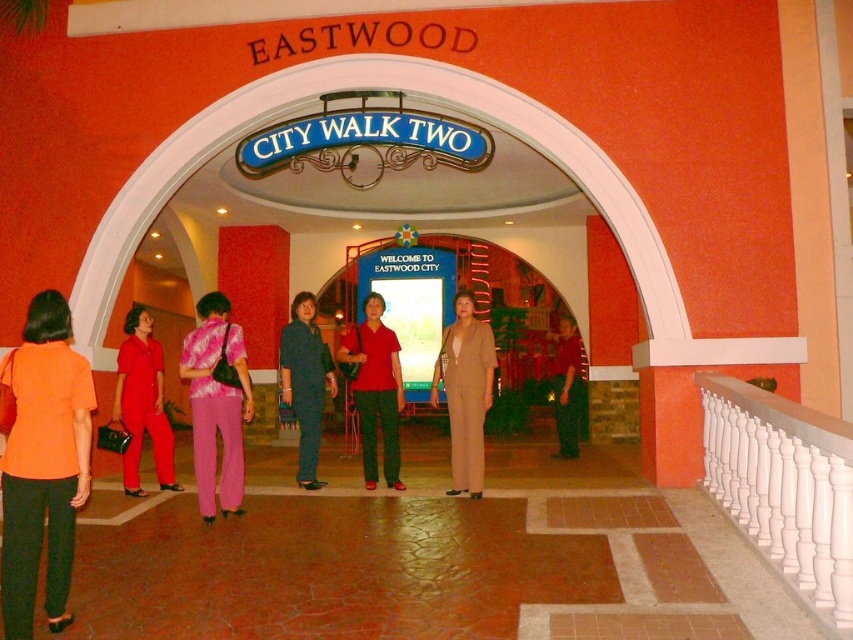
Question: Is dark blue shirt at center wider than matte red pants at center?

Choices:
 (A) no
 (B) yes

Answer: (B)

Question: Which object appears farthest from the camera in this image?

Choices:
 (A) white glossy balustrade at right
 (B) pink satin blouse at center
 (C) matte red jumpsuit at left
 (D) dark blue shirt at center

Answer: (D)

Question: Does tan fabric suit at center appear on the left side of matte red shirt at center?

Choices:
 (A) no
 (B) yes

Answer: (A)

Question: Is pink satin blouse at center to the right of matte red pants at center from the viewer's perspective?

Choices:
 (A) no
 (B) yes

Answer: (A)

Question: Which point is farther from the camera taking this photo?

Choices:
 (A) (468, 326)
 (B) (51, 378)

Answer: (A)

Question: Among these points, which one is farthest from the camera?

Choices:
 (A) (491, 387)
 (B) (553, 374)

Answer: (B)